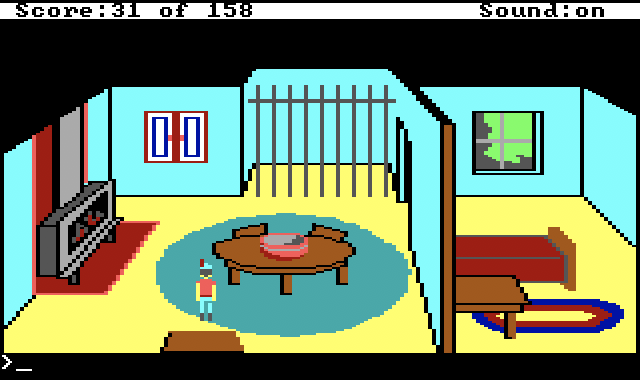
Find the location of a particular element. bed is located at coordinates (509, 249).